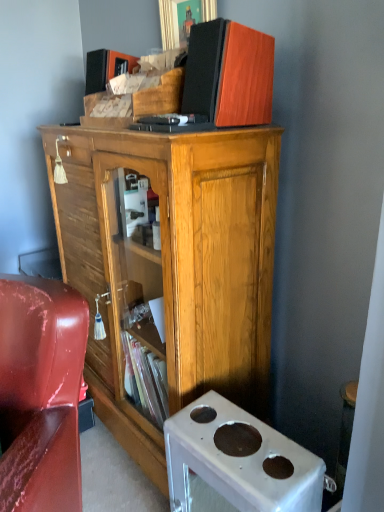
Question: Is glossy leather chair at lower left positioned behind wooden cabinet at center?

Choices:
 (A) no
 (B) yes

Answer: (A)

Question: From the image's perspective, would you say glossy leather chair at lower left is shown under wooden cabinet at center?

Choices:
 (A) yes
 (B) no

Answer: (A)

Question: Can you confirm if glossy leather chair at lower left is wider than wooden cabinet at center?

Choices:
 (A) yes
 (B) no

Answer: (A)

Question: Is glossy leather chair at lower left positioned in front of wooden cabinet at center?

Choices:
 (A) yes
 (B) no

Answer: (A)

Question: From the image's perspective, is glossy leather chair at lower left above wooden cabinet at center?

Choices:
 (A) no
 (B) yes

Answer: (A)

Question: Is wooden speaker at upper center inside or outside of white plastic desk at lower right?

Choices:
 (A) outside
 (B) inside

Answer: (A)

Question: Looking at the image, does wooden speaker at upper center seem bigger or smaller compared to white plastic desk at lower right?

Choices:
 (A) small
 (B) big

Answer: (A)

Question: In the image, is wooden speaker at upper center on the left side or the right side of white plastic desk at lower right?

Choices:
 (A) right
 (B) left

Answer: (B)

Question: From the image's perspective, is wooden speaker at upper center positioned above or below white plastic desk at lower right?

Choices:
 (A) below
 (B) above

Answer: (B)

Question: From the image's perspective, relative to white plastic desk at lower right, is wooden cabinet at center above or below?

Choices:
 (A) above
 (B) below

Answer: (A)

Question: Do you think wooden cabinet at center is within white plastic desk at lower right, or outside of it?

Choices:
 (A) outside
 (B) inside

Answer: (A)

Question: Would you say wooden cabinet at center is to the left or to the right of white plastic desk at lower right in the picture?

Choices:
 (A) left
 (B) right

Answer: (A)

Question: From a real-world perspective, is wooden cabinet at center physically located above or below white plastic desk at lower right?

Choices:
 (A) below
 (B) above

Answer: (B)

Question: Considering their positions, is wooden cabinet at center located in front of or behind wooden speaker at upper center?

Choices:
 (A) front
 (B) behind

Answer: (A)

Question: Considering the positions of wooden cabinet at center and wooden speaker at upper center in the image, is wooden cabinet at center taller or shorter than wooden speaker at upper center?

Choices:
 (A) short
 (B) tall

Answer: (B)